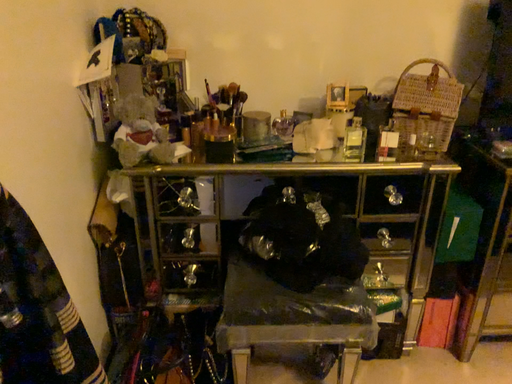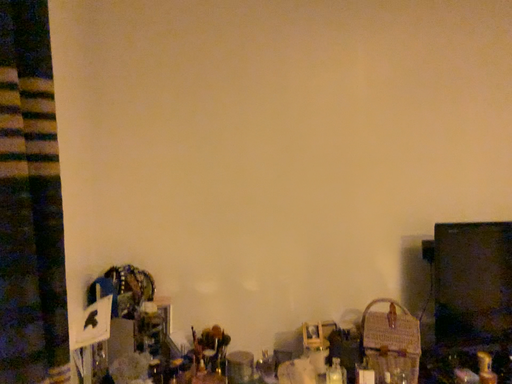
Question: Which way did the camera rotate in the video?

Choices:
 (A) rotated left
 (B) rotated right

Answer: (B)